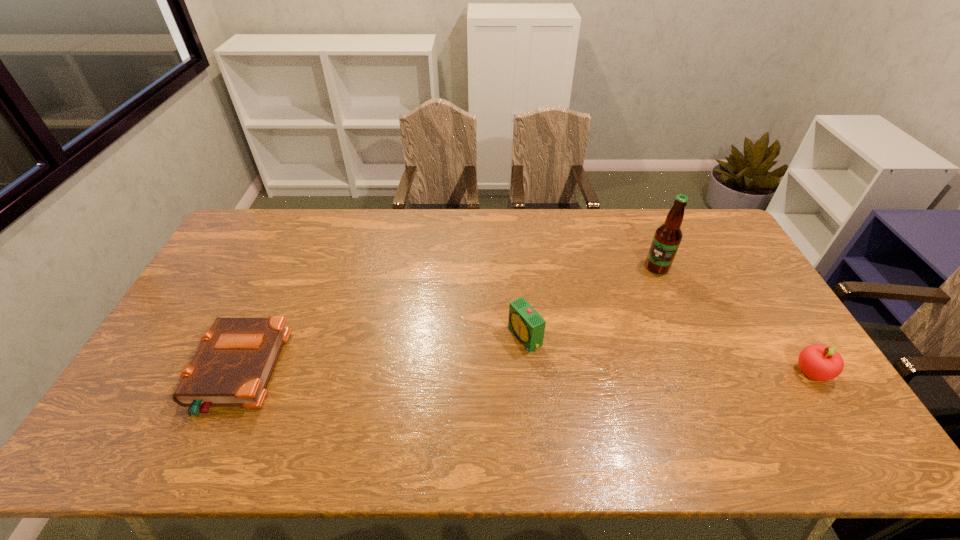
You are a GUI agent. You are given a task and a screenshot of the screen. Output one action in this format:
    pyautogui.click(x=<x>, y=<y>)
    Task: Click on the leftmost object
    This screenshot has width=960, height=540.
    Given the screenshot: What is the action you would take?
    pyautogui.click(x=233, y=366)

The image size is (960, 540). Find the location of `Bible`. Bible is located at coordinates (233, 366).

Where is `apple`? apple is located at coordinates (819, 362).

Find the location of a particular element. The image size is (960, 540). the tallest object is located at coordinates pos(667,238).

The image size is (960, 540). I want to click on the second object from right to left, so click(667, 238).

I want to click on the second object from left to right, so click(524, 321).

Identify the location of blank space located on the spine side of the leftmost object. The image size is (960, 540). (180, 372).

Find the location of a particular element. This screenshot has width=960, height=540. vacant space located 0.060m on the spine side of the leftmost object is located at coordinates (176, 372).

You are a GUI agent. You are given a task and a screenshot of the screen. Output one action in this format:
    pyautogui.click(x=<x>, y=<y>)
    Task: Click on the vacant space located on the front of the rightmost object
    The image size is (960, 540).
    Given the screenshot: What is the action you would take?
    pyautogui.click(x=833, y=405)

Find the location of a particular element. This screenshot has width=960, height=540. vacant space located on the label of the tallest object is located at coordinates (621, 287).